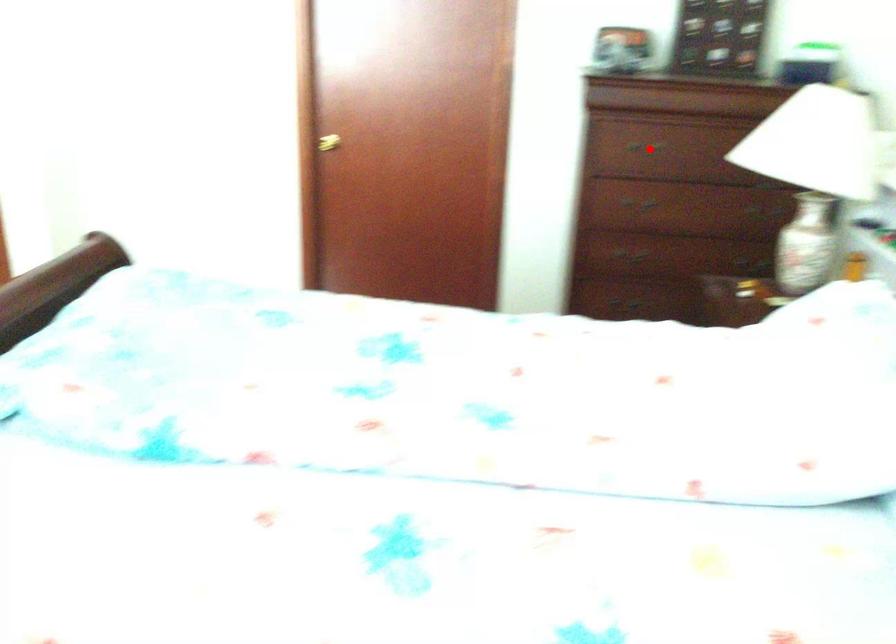
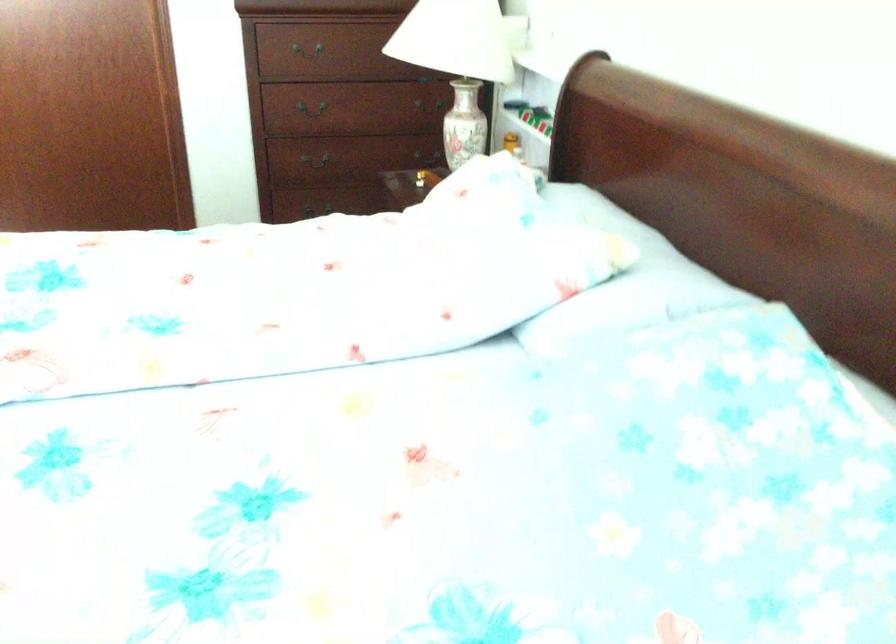
Find the pixel in the second image that matches the highlighted location in the first image.

(309, 52)